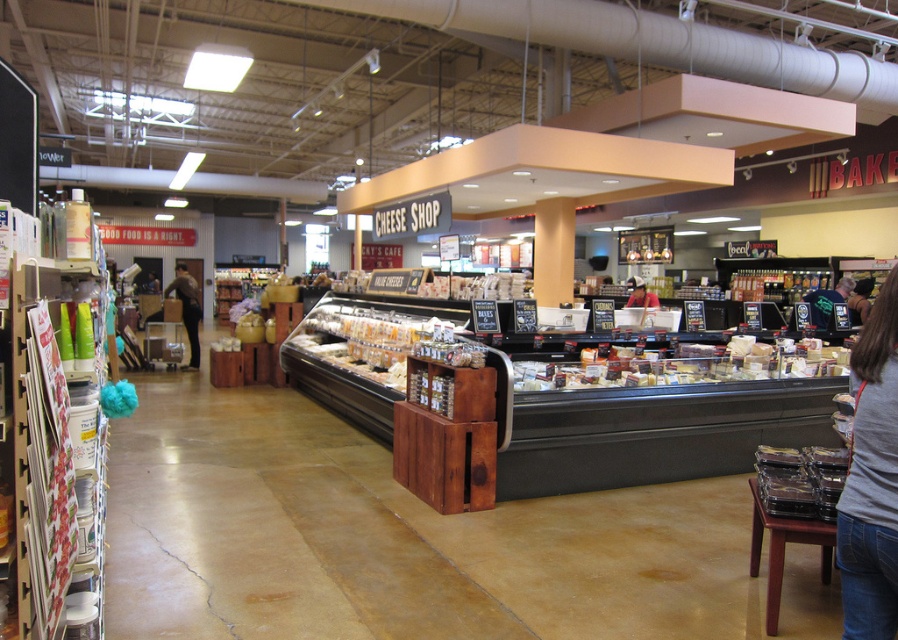
Can you confirm if translucent plastic cheese at center is smaller than translucent plastic containers at center?

Correct, translucent plastic cheese at center occupies less space than translucent plastic containers at center.

Can you confirm if translucent plastic cheese at center is thinner than translucent plastic containers at center?

Incorrect, translucent plastic cheese at center's width is not less than translucent plastic containers at center's.

This screenshot has height=640, width=898. In order to click on translucent plastic cheese at center in this screenshot , I will do `click(674, 364)`.

This screenshot has height=640, width=898. Identify the location of translucent plastic cheese at center. point(674,364).

Who is lower down, clear plastic containers at lower right or brown leather jacket at left?

clear plastic containers at lower right

The height and width of the screenshot is (640, 898). What do you see at coordinates (800, 481) in the screenshot?
I see `clear plastic containers at lower right` at bounding box center [800, 481].

Is point (816, 454) closer to camera compared to point (192, 348)?

Yes, it is in front of point (192, 348).

Where is `clear plastic containers at lower right`? The height and width of the screenshot is (640, 898). clear plastic containers at lower right is located at coordinates (800, 481).

Does gray cotton shirt at lower right appear over clear plastic containers at lower right?

Yes.

Between point (854, 600) and point (810, 460), which one is positioned in front?

Point (854, 600) is in front.

The width and height of the screenshot is (898, 640). I want to click on gray cotton shirt at lower right, so click(x=870, y=477).